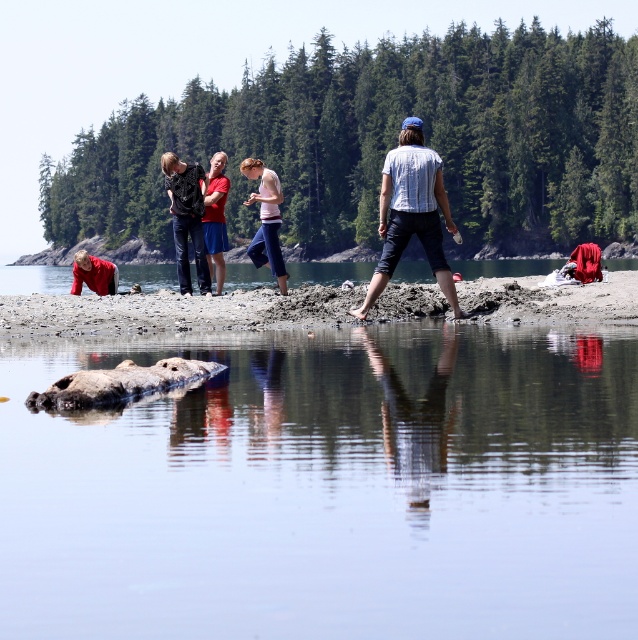
You are a photographer aiming to capture a closeup of the smooth gray rock at center and the matte black clothing at center. Which object should you adjust your camera focus to first if you want to ensure both are in frame without moving the camera?

You should focus on the matte black clothing at center first because the smooth gray rock at center is to the right of it, so adjusting focus starting from the left will naturally include both in the frame.